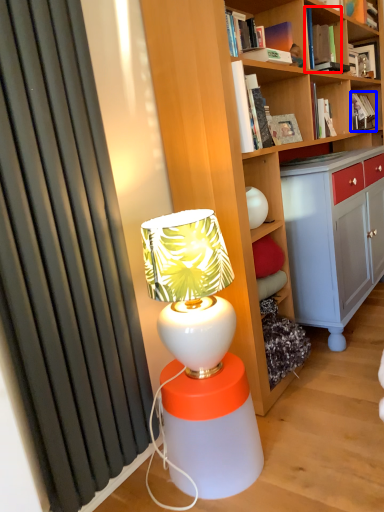
Question: Which point is further to the camera, book (highlighted by a red box) or book (highlighted by a blue box)?

Choices:
 (A) book
 (B) book

Answer: (B)